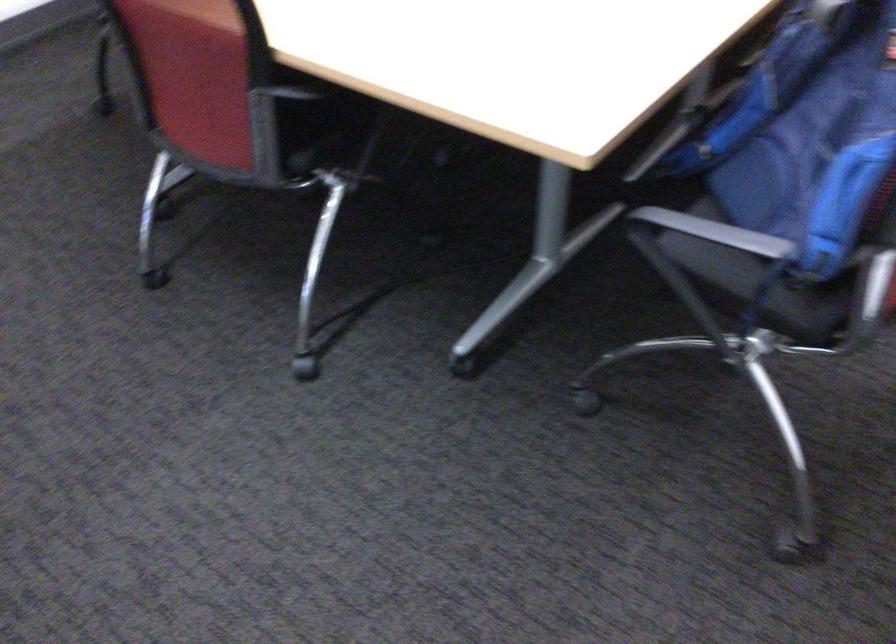
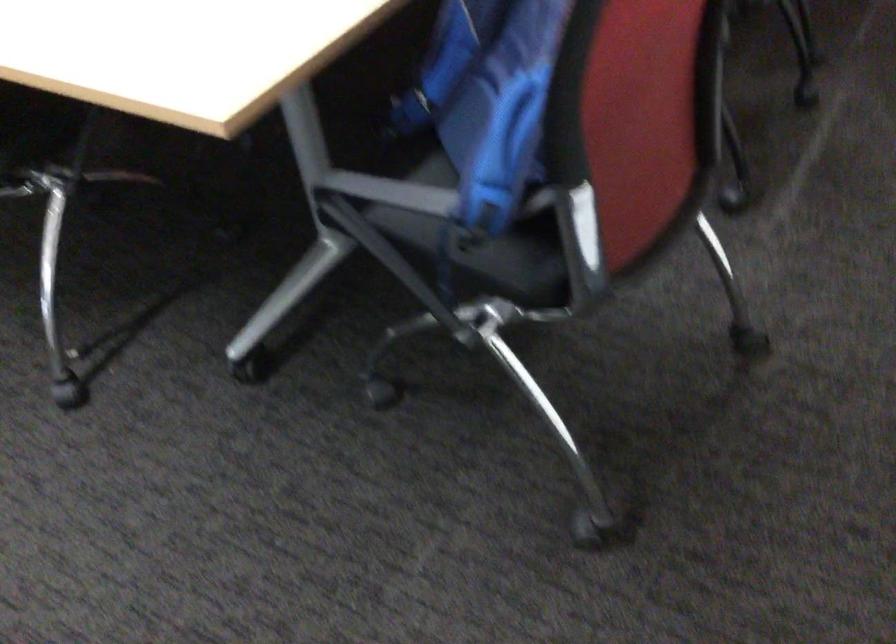
Question: The camera is either moving clockwise (left) or counter-clockwise (right) around the object. The first image is from the beginning of the video and the second image is from the end. Is the camera moving left or right when shooting the video?

Choices:
 (A) Left
 (B) Right

Answer: (A)